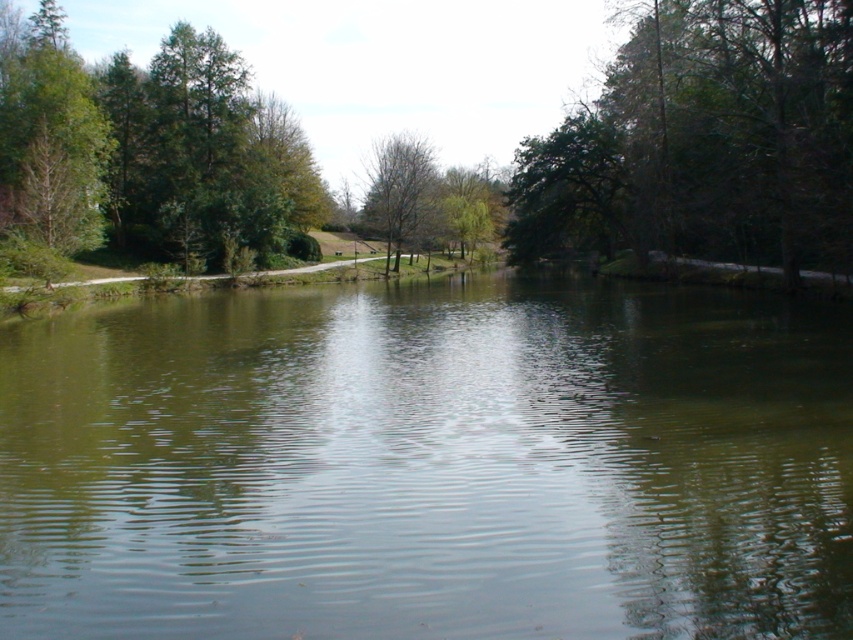
Question: Which object is positioned farthest from the green reflective water at center?

Choices:
 (A) green leafy tree at upper right
 (B) green leafy tree at left
 (C) green matte tree at left

Answer: (B)

Question: Estimate the real-world distances between objects in this image. Which object is farther from the green leafy tree at left?

Choices:
 (A) green leafy tree at upper right
 (B) green matte tree at left

Answer: (A)

Question: Which object appears farthest from the camera in this image?

Choices:
 (A) bare branches tree at center
 (B) green leafy tree at left
 (C) green matte tree at left

Answer: (A)

Question: Can you confirm if green leafy tree at upper right is positioned above bare branches tree at center?

Choices:
 (A) no
 (B) yes

Answer: (A)

Question: Does green leafy tree at upper right appear on the left side of green leafy tree at left?

Choices:
 (A) yes
 (B) no

Answer: (B)

Question: Can you confirm if green leafy tree at upper right is bigger than green matte tree at left?

Choices:
 (A) no
 (B) yes

Answer: (B)